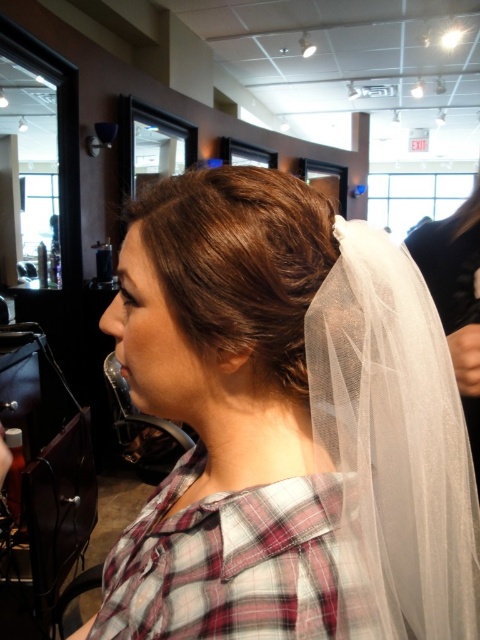
Is white sheer veil at upper center wider than brown silky hair bun at upper center?

Indeed, white sheer veil at upper center has a greater width compared to brown silky hair bun at upper center.

Which is above, white sheer veil at upper center or brown silky hair bun at upper center?

brown silky hair bun at upper center is above.

This screenshot has height=640, width=480. What do you see at coordinates (288, 426) in the screenshot?
I see `white sheer veil at upper center` at bounding box center [288, 426].

Where is `white sheer veil at upper center`? The height and width of the screenshot is (640, 480). white sheer veil at upper center is located at coordinates pos(288,426).